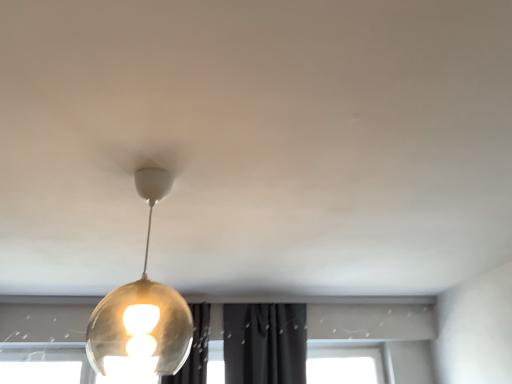
Question: Should I look upward or downward to see translucent glass globe at center?

Choices:
 (A) up
 (B) down

Answer: (B)